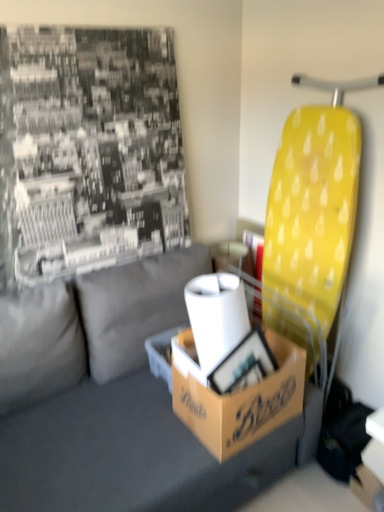
Question: Is brown cardboard box at center at the right side of white matte toilet paper at center?

Choices:
 (A) no
 (B) yes

Answer: (A)

Question: Is brown cardboard box at center thinner than white matte toilet paper at center?

Choices:
 (A) yes
 (B) no

Answer: (A)

Question: Is brown cardboard box at center in front of white matte toilet paper at center?

Choices:
 (A) no
 (B) yes

Answer: (A)

Question: From the image's perspective, is brown cardboard box at center located above white matte toilet paper at center?

Choices:
 (A) no
 (B) yes

Answer: (A)

Question: Is brown cardboard box at center oriented towards white matte toilet paper at center?

Choices:
 (A) yes
 (B) no

Answer: (B)

Question: Considering the positions of brown cardboard box at center and brown cardboard box at center in the image, is brown cardboard box at center taller or shorter than brown cardboard box at center?

Choices:
 (A) short
 (B) tall

Answer: (A)

Question: From the image's perspective, relative to brown cardboard box at center, is brown cardboard box at center above or below?

Choices:
 (A) above
 (B) below

Answer: (A)

Question: Is brown cardboard box at center inside the boundaries of brown cardboard box at center, or outside?

Choices:
 (A) inside
 (B) outside

Answer: (B)

Question: In terms of width, does brown cardboard box at center look wider or thinner when compared to brown cardboard box at center?

Choices:
 (A) wide
 (B) thin

Answer: (B)

Question: Relative to white matte toilet paper at center, is brown cardboard box at center in front or behind?

Choices:
 (A) behind
 (B) front

Answer: (A)

Question: From a real-world perspective, is brown cardboard box at center above or below white matte toilet paper at center?

Choices:
 (A) above
 (B) below

Answer: (B)

Question: Is brown cardboard box at center taller or shorter than white matte toilet paper at center?

Choices:
 (A) short
 (B) tall

Answer: (A)

Question: Is brown cardboard box at center to the left or to the right of white matte toilet paper at center in the image?

Choices:
 (A) right
 (B) left

Answer: (B)

Question: From the image's perspective, is brown cardboard box at center located above or below gray fabric couch at center?

Choices:
 (A) above
 (B) below

Answer: (A)

Question: Considering the positions of brown cardboard box at center and gray fabric couch at center in the image, is brown cardboard box at center wider or thinner than gray fabric couch at center?

Choices:
 (A) thin
 (B) wide

Answer: (A)